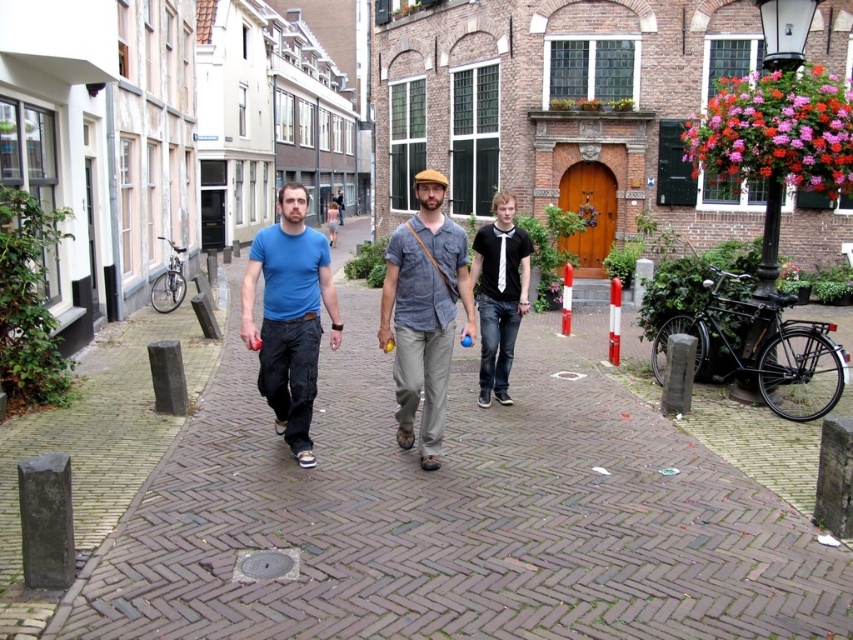
Question: Which is nearer to the brown brick pavement at center?

Choices:
 (A) matte blue t-shirt at center
 (B) black matte shirt at center
 (C) blue cotton t-shirt at center

Answer: (A)

Question: Is matte blue t-shirt at center below black matte shirt at center?

Choices:
 (A) yes
 (B) no

Answer: (A)

Question: Which point is farther from the camera taking this photo?

Choices:
 (A) (439, 285)
 (B) (315, 620)
 (C) (268, 348)
 (D) (422, 221)

Answer: (C)

Question: Estimate the real-world distances between objects in this image. Which object is farther from the matte blue t-shirt at center?

Choices:
 (A) denim shirt at center
 (B) black matte shirt at center
 (C) blue cotton t-shirt at center

Answer: (B)

Question: Is matte blue t-shirt at center to the left of blue cotton t-shirt at center from the viewer's perspective?

Choices:
 (A) yes
 (B) no

Answer: (A)

Question: Does denim shirt at center have a lesser width compared to matte blue t-shirt at center?

Choices:
 (A) no
 (B) yes

Answer: (B)